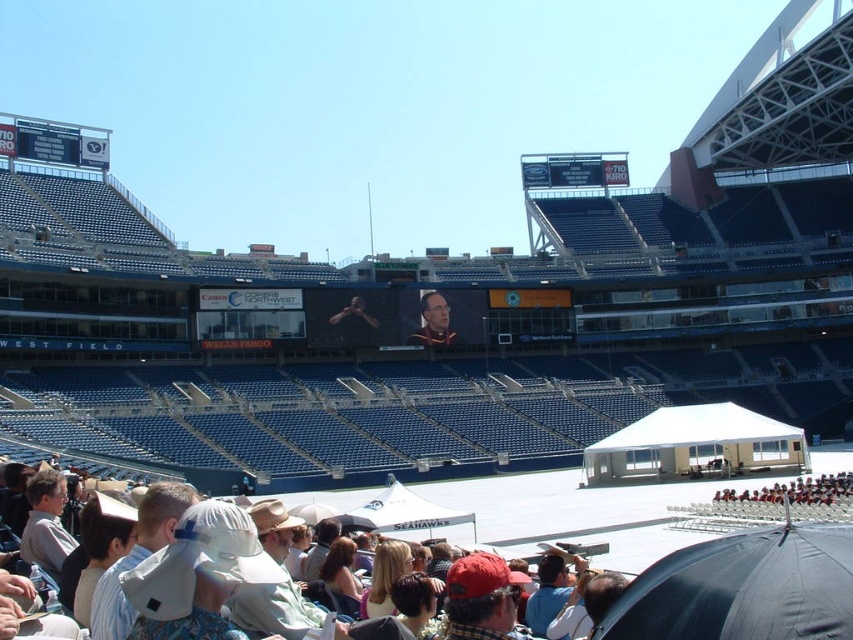
Can you confirm if white digital scoreboard at upper left is thinner than smooth skin face at center?

In fact, white digital scoreboard at upper left might be wider than smooth skin face at center.

Does white digital scoreboard at upper left have a smaller size compared to smooth skin face at center?

No, white digital scoreboard at upper left is not smaller than smooth skin face at center.

Does point (74, 129) lie behind point (346, 324)?

Yes, point (74, 129) is behind point (346, 324).

I want to click on white digital scoreboard at upper left, so click(x=53, y=141).

This screenshot has height=640, width=853. Describe the element at coordinates (434, 321) in the screenshot. I see `matte black suit at center` at that location.

Is matte black suit at center positioned at the back of smooth skin face at center?

Yes.

Is point (448, 307) positioned after point (363, 337)?

Yes, point (448, 307) is farther from viewer.

This screenshot has width=853, height=640. Find the location of `matte black suit at center`. matte black suit at center is located at coordinates (434, 321).

Is point (817, 582) positioned after point (108, 136)?

That is False.

Is black fabric umbrella at lower right further to camera compared to white digital scoreboard at upper left?

No, black fabric umbrella at lower right is closer to the viewer.

Does point (772, 564) come in front of point (53, 140)?

Yes, it is.

Find the location of a particular element. The width and height of the screenshot is (853, 640). black fabric umbrella at lower right is located at coordinates 743,588.